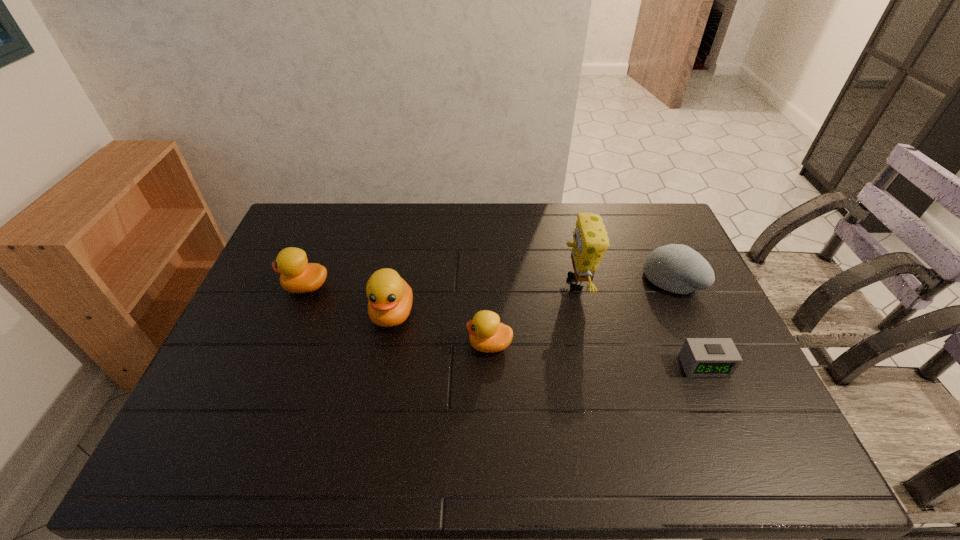
Image resolution: width=960 pixels, height=540 pixels. I want to click on the leftmost duckling, so click(297, 275).

The image size is (960, 540). I want to click on the leftmost object, so click(x=297, y=275).

Identify the location of the fifth object from right to left. (390, 298).

You are a GUI agent. You are given a task and a screenshot of the screen. Output one action in this format:
    pyautogui.click(x=<x>, y=<y>)
    Task: Click on the shortest duckling
    
    Given the screenshot: What is the action you would take?
    pyautogui.click(x=487, y=334)

You are a GUI agent. You are given a task and a screenshot of the screen. Output one action in this format:
    pyautogui.click(x=<x>, y=<y>)
    Task: Click on the fourth object from right to left
    
    Given the screenshot: What is the action you would take?
    pyautogui.click(x=487, y=334)

You are a GUI agent. You are given a task and a screenshot of the screen. Output one action in this format:
    pyautogui.click(x=<x>, y=<y>)
    Task: Click on the shortest object
    
    Given the screenshot: What is the action you would take?
    pyautogui.click(x=700, y=357)

Where is `the third object from right to left`? The image size is (960, 540). the third object from right to left is located at coordinates (590, 243).

Image resolution: width=960 pixels, height=540 pixels. I want to click on sponge, so click(590, 243).

This screenshot has height=540, width=960. What are the coordinates of `beanie` in the screenshot? It's located at (677, 268).

You are a GUI agent. You are given a task and a screenshot of the screen. Output one action in this format:
    pyautogui.click(x=<x>, y=<y>)
    Task: Click on the vacant region located 0.250m on the face of the second duckling from right to left
    This screenshot has width=960, height=540.
    Given the screenshot: What is the action you would take?
    pyautogui.click(x=372, y=421)